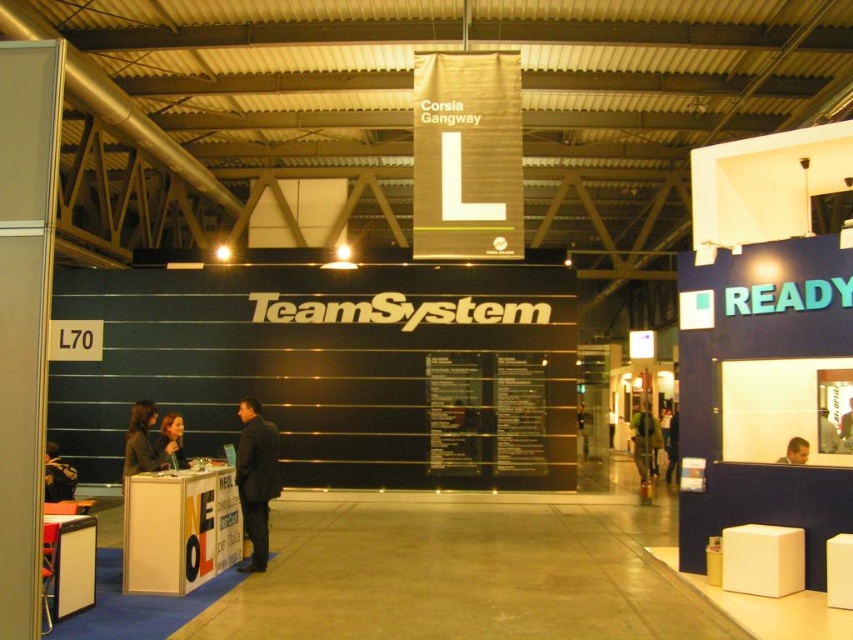
You are a photographer at the exhibition and want to capture both the green fabric jacket at center and the light brown hair at center in a single shot. Which object should you focus on first to ensure both are in focus?

You should focus on the green fabric jacket at center first because it is closer to you than the light brown hair at center, so focusing on the closer object will help both be in focus.

You are a fashion buyer attending the conference and need to decide which jacket to purchase. You see the dark brown leather jacket at left and the matte black jacket at center. Which jacket is positioned more to the left side of the booth?

The dark brown leather jacket at left is positioned more to the left side of the booth than the matte black jacket at center.

You are a fashion designer attending the conference and you need to place a mannequin between the green fabric jacket at center and the matte black jacket at center. What is the minimum distance you need to ensure between the two jackets to fit the mannequin?

The green fabric jacket at center and matte black jacket at center are 35.27 feet apart, so the minimum distance needed to fit the mannequin would be 35.27 feet.